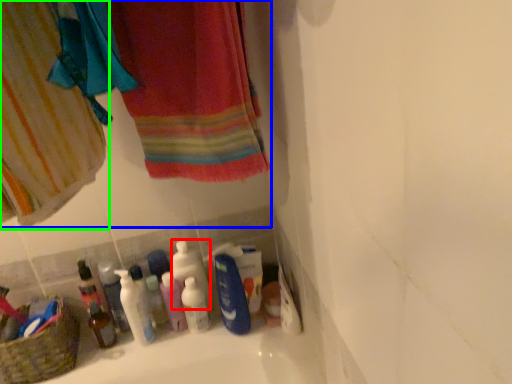
Question: Based on their relative distances, which object is nearer to cleaning product (highlighted by a red box)? Choose from laundry (highlighted by a blue box) and curtain (highlighted by a green box).

Choices:
 (A) laundry
 (B) curtain

Answer: (A)